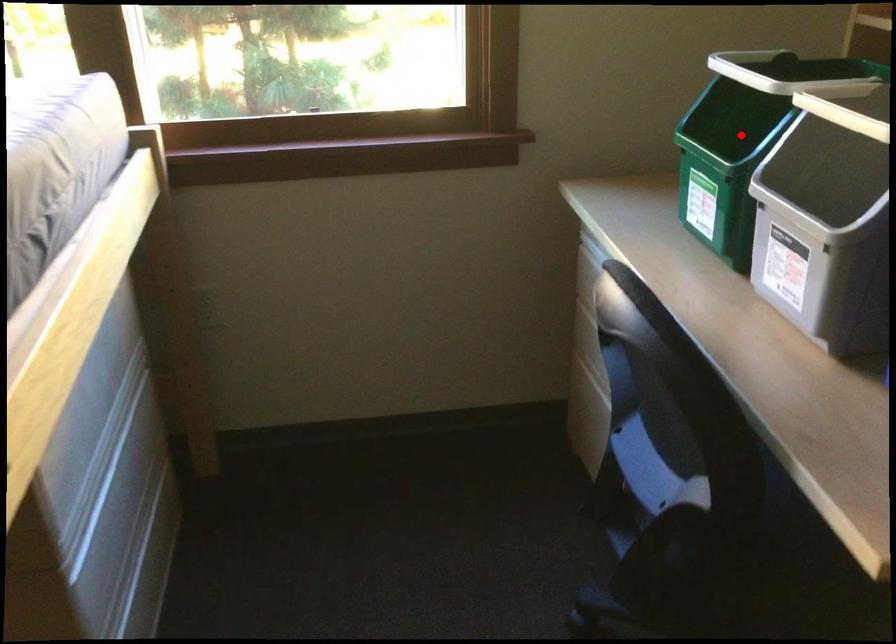
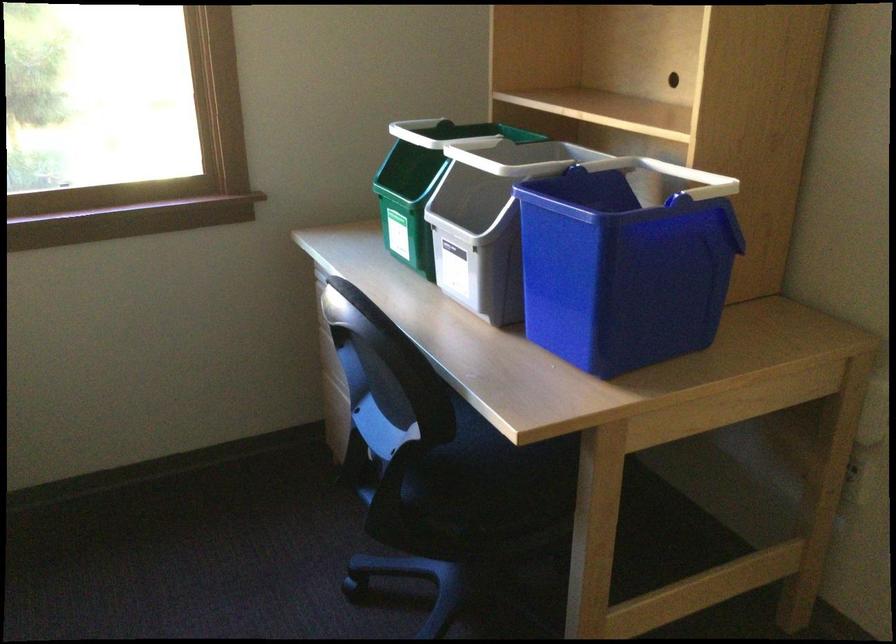
Find the pixel in the second image that matches the highlighted location in the first image.

(421, 184)